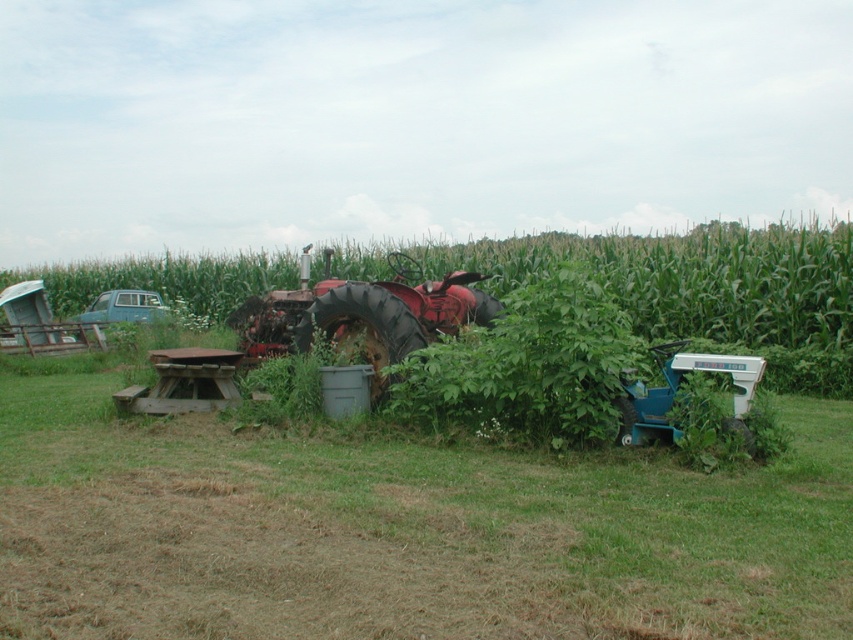
Is rusty metal tractor at center wider than teal plastic tractor at lower right?

Yes, rusty metal tractor at center is wider than teal plastic tractor at lower right.

Does rusty metal tractor at center have a greater height compared to teal plastic tractor at lower right?

Indeed, rusty metal tractor at center has a greater height compared to teal plastic tractor at lower right.

Between point (238, 314) and point (749, 403), which one is positioned behind?

The point (238, 314) is behind.

This screenshot has height=640, width=853. In order to click on rusty metal tractor at center in this screenshot , I will do `click(363, 314)`.

Is point (201, 582) positioned after point (695, 307)?

No, it is not.

Is point (396, 486) positioned before point (759, 323)?

Yes, point (396, 486) is in front of point (759, 323).

The width and height of the screenshot is (853, 640). Describe the element at coordinates (402, 531) in the screenshot. I see `green grass at center` at that location.

I want to click on green grass at center, so click(402, 531).

Can you confirm if green grass at center is positioned below rusty metal tractor at center?

Correct, green grass at center is located below rusty metal tractor at center.

Who is higher up, green grass at center or rusty metal tractor at center?

rusty metal tractor at center is above.

At what (x,y) coordinates should I click in order to perform the action: click on green grass at center. Please return your answer as a coordinate pair (x, y). The width and height of the screenshot is (853, 640). Looking at the image, I should click on (402, 531).

Where is `green grass at center`? The width and height of the screenshot is (853, 640). green grass at center is located at coordinates (402, 531).